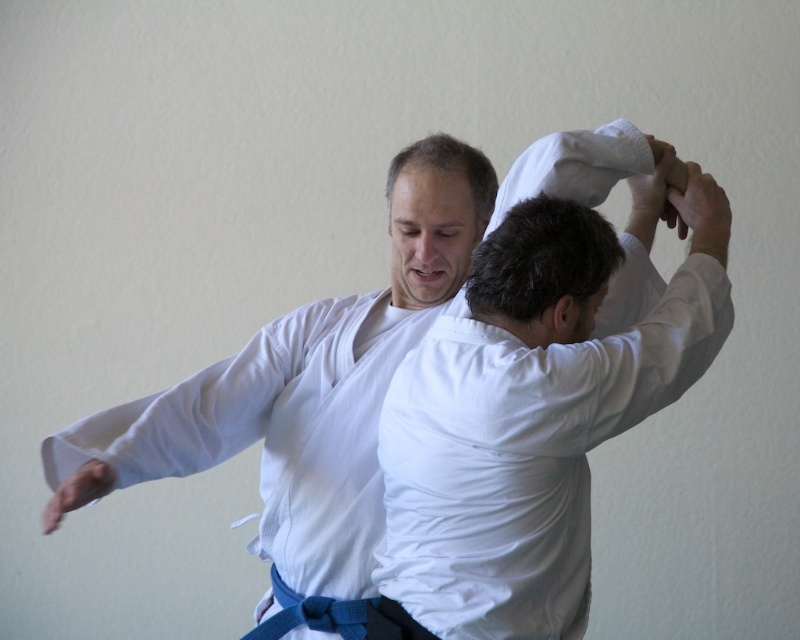
Question: Is white cotton kimono at center below white cotton shirt at center?

Choices:
 (A) yes
 (B) no

Answer: (B)

Question: Which point is farther to the camera?

Choices:
 (A) white cotton shirt at center
 (B) white cotton kimono at center

Answer: (B)

Question: Can you confirm if white cotton kimono at center is thinner than white cotton shirt at center?

Choices:
 (A) no
 (B) yes

Answer: (A)

Question: Is white cotton kimono at center above white cotton shirt at center?

Choices:
 (A) yes
 (B) no

Answer: (A)

Question: Among these points, which one is farthest from the camera?

Choices:
 (A) 470,221
 (B) 570,406

Answer: (A)